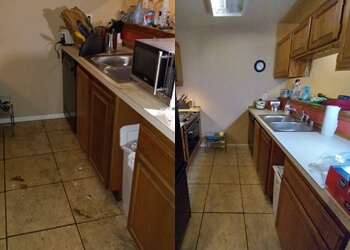
Find the location of `paper towel`. paper towel is located at coordinates (331, 122).